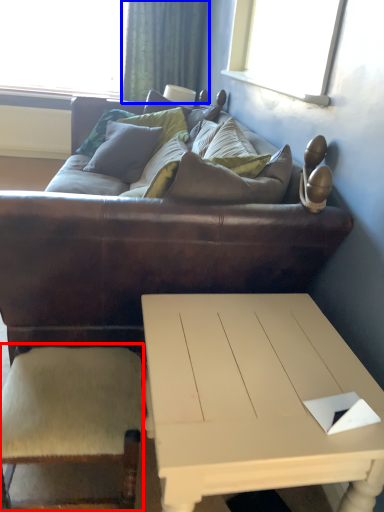
Question: Which of the following is the farthest to the observer, armchair (highlighted by a red box) or curtain (highlighted by a blue box)?

Choices:
 (A) armchair
 (B) curtain

Answer: (B)